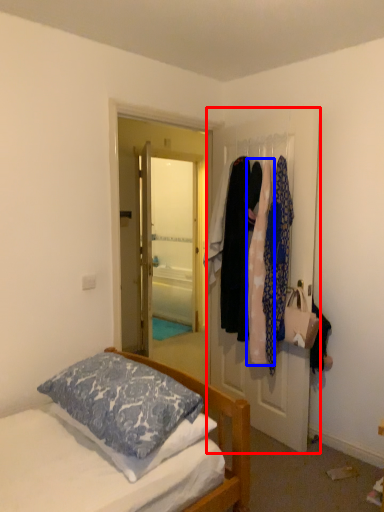
Question: Which object is closer to the camera taking this photo, door (highlighted by a red box) or clothing (highlighted by a blue box)?

Choices:
 (A) door
 (B) clothing

Answer: (A)